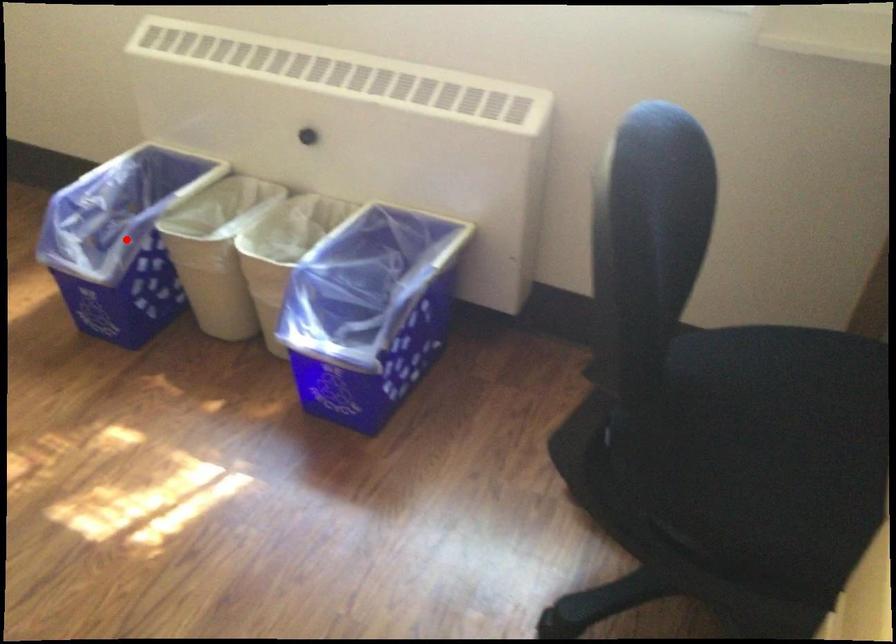
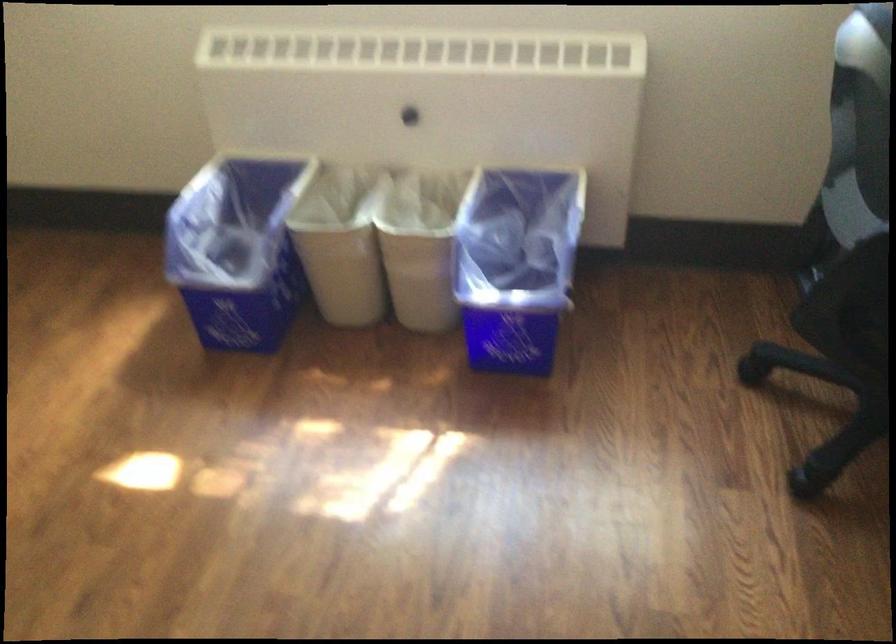
Find the pixel in the second image that matches the highlighted location in the first image.

(237, 249)